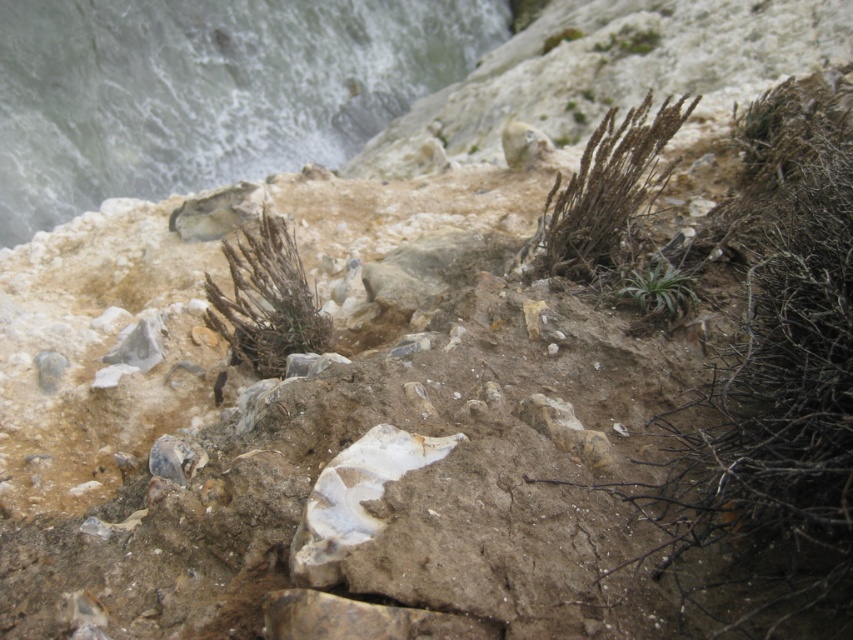
Can you confirm if white frothy water at upper left is positioned below brown dry grass at upper center?

Actually, white frothy water at upper left is above brown dry grass at upper center.

Is white frothy water at upper left thinner than brown dry grass at upper center?

No, white frothy water at upper left is not thinner than brown dry grass at upper center.

Which is in front, point (167, 1) or point (567, 228)?

Positioned in front is point (567, 228).

You are a GUI agent. You are given a task and a screenshot of the screen. Output one action in this format:
    pyautogui.click(x=<x>, y=<y>)
    Task: Click on the white frothy water at upper left
    This screenshot has height=640, width=853.
    Given the screenshot: What is the action you would take?
    pyautogui.click(x=207, y=90)

Can you confirm if white frothy water at upper left is positioned above green leafy plant at center?

Indeed, white frothy water at upper left is positioned over green leafy plant at center.

Who is more forward, (65, 6) or (683, 307)?

Positioned in front is point (683, 307).

Which is behind, point (74, 145) or point (653, 288)?

The point (74, 145) is behind.

At what (x,y) coordinates should I click in order to perform the action: click on white frothy water at upper left. Please return your answer as a coordinate pair (x, y). The height and width of the screenshot is (640, 853). Looking at the image, I should click on (207, 90).

How distant is brown dry grass at upper center from brown textured plant at center?

A distance of 23.73 inches exists between brown dry grass at upper center and brown textured plant at center.

Can you confirm if brown dry grass at upper center is positioned to the left of brown textured plant at center?

Incorrect, brown dry grass at upper center is not on the left side of brown textured plant at center.

Is point (560, 244) positioned before point (254, 292)?

Yes, it is.

Find the location of `brown dry grass at upper center`. brown dry grass at upper center is located at coordinates (608, 192).